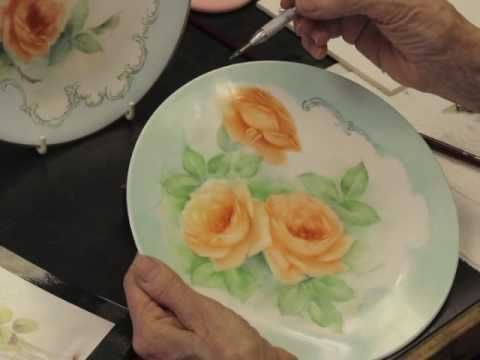
Identify the location of decorative plate stand. (43, 150).